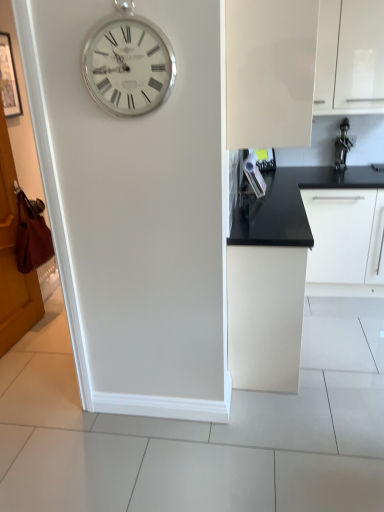
Question: Based on their sizes in the image, would you say white glossy cabinet at upper right, the third cabinetry from the bottom, is bigger or smaller than silver metallic clock at upper left?

Choices:
 (A) small
 (B) big

Answer: (B)

Question: From the image's perspective, is white glossy cabinet at upper right, the third cabinetry from the bottom, positioned above or below silver metallic clock at upper left?

Choices:
 (A) above
 (B) below

Answer: (A)

Question: Considering the real-world distances, which object is closest to the white glossy cabinet at upper right, which is the first cabinetry in top-to-bottom order?

Choices:
 (A) metallic silver figurine at upper right
 (B) matte white cabinet at center, which appears as the 1th cabinetry when ordered from the bottom
 (C) glossy white cabinet at upper right, acting as the second cabinetry starting from the bottom
 (D) silver metallic clock at upper left
 (E) brown wooden door at left

Answer: (A)

Question: Based on their relative distances, which object is farther from the glossy white cabinet at upper right, acting as the second cabinetry starting from the bottom?

Choices:
 (A) matte white cabinet at center, the third cabinetry from the top
 (B) silver metallic clock at upper left
 (C) metallic silver figurine at upper right
 (D) white glossy cabinet at upper right, the third cabinetry from the bottom
 (E) brown wooden door at left

Answer: (E)